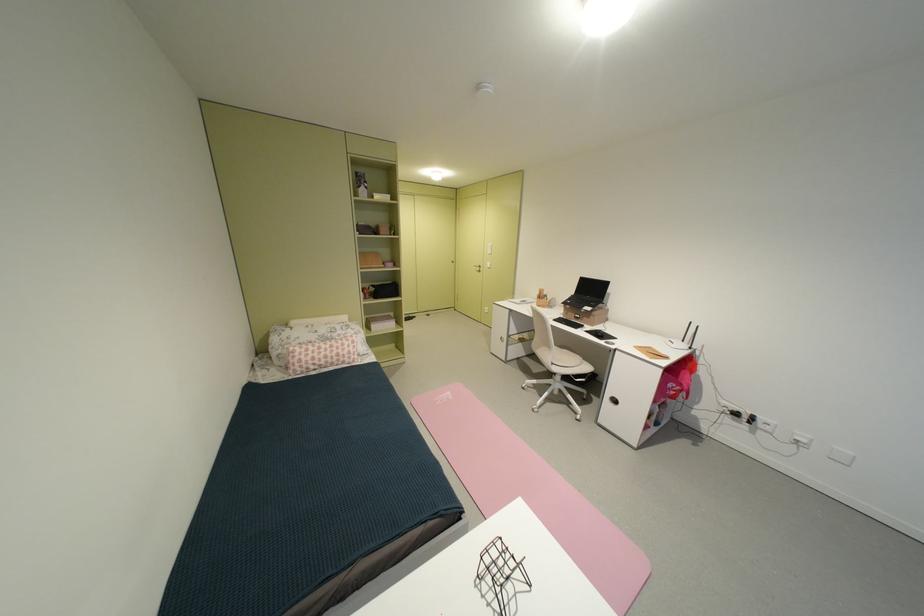
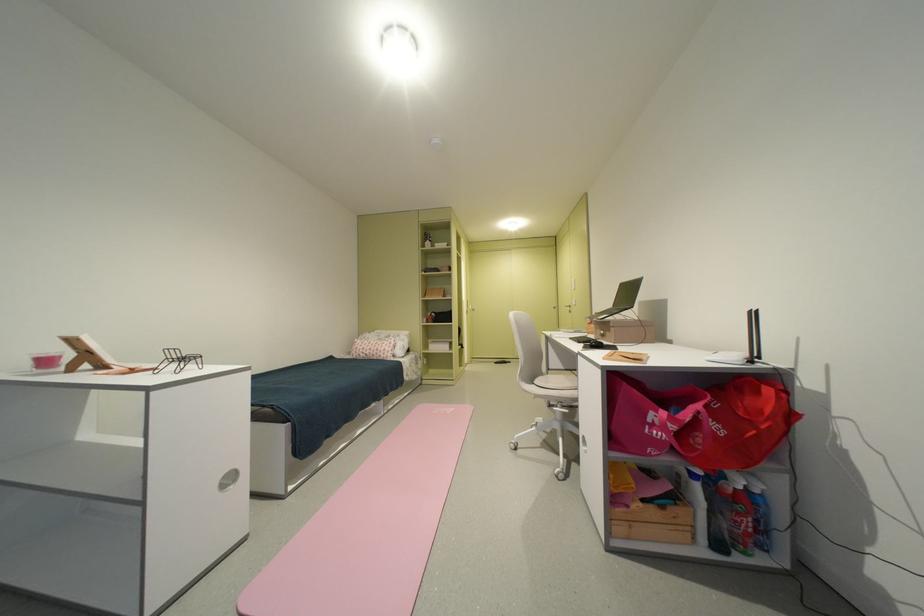
The point at (353,357) is marked in the first image. Where is the corresponding point in the second image?

(390, 352)